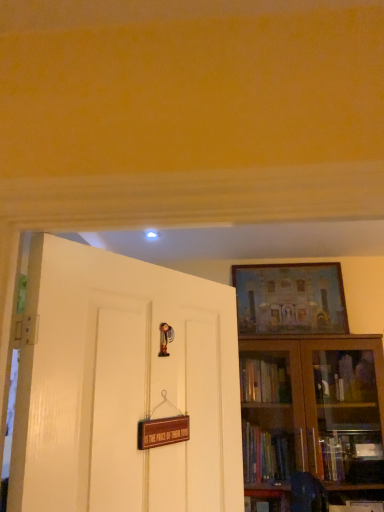
Question: From the image's perspective, does white glossy door at left appear higher than brown wooden bookcase at right?

Choices:
 (A) no
 (B) yes

Answer: (B)

Question: Is brown wooden bookcase at right inside white glossy door at left?

Choices:
 (A) no
 (B) yes

Answer: (A)

Question: Is white glossy door at left turned away from brown wooden bookcase at right?

Choices:
 (A) no
 (B) yes

Answer: (A)

Question: Considering the relative sizes of white glossy door at left and brown wooden bookcase at right in the image provided, is white glossy door at left thinner than brown wooden bookcase at right?

Choices:
 (A) no
 (B) yes

Answer: (B)

Question: Does white glossy door at left turn towards brown wooden bookcase at right?

Choices:
 (A) yes
 (B) no

Answer: (B)

Question: Considering their positions, is white glossy door at left located in front of or behind brown wooden bookcase at right?

Choices:
 (A) front
 (B) behind

Answer: (A)

Question: Which is correct: white glossy door at left is inside brown wooden bookcase at right, or outside of it?

Choices:
 (A) outside
 (B) inside

Answer: (A)

Question: From a real-world perspective, is white glossy door at left positioned above or below brown wooden bookcase at right?

Choices:
 (A) above
 (B) below

Answer: (A)

Question: Considering the relative positions of white glossy door at left and brown wooden bookcase at right in the image provided, is white glossy door at left to the left or to the right of brown wooden bookcase at right?

Choices:
 (A) right
 (B) left

Answer: (B)

Question: Considering the positions of white glossy door at left and matte wooden picture frame at upper right in the image, is white glossy door at left wider or thinner than matte wooden picture frame at upper right?

Choices:
 (A) wide
 (B) thin

Answer: (A)

Question: Considering the relative positions of white glossy door at left and matte wooden picture frame at upper right in the image provided, is white glossy door at left to the left or to the right of matte wooden picture frame at upper right?

Choices:
 (A) right
 (B) left

Answer: (B)

Question: Would you say white glossy door at left is inside or outside matte wooden picture frame at upper right?

Choices:
 (A) inside
 (B) outside

Answer: (B)

Question: Considering the positions of white glossy door at left and matte wooden picture frame at upper right in the image, is white glossy door at left taller or shorter than matte wooden picture frame at upper right?

Choices:
 (A) short
 (B) tall

Answer: (B)

Question: From a real-world perspective, is brown wooden bookcase at right physically located above or below matte wooden picture frame at upper right?

Choices:
 (A) below
 (B) above

Answer: (A)

Question: Considering the positions of brown wooden bookcase at right and matte wooden picture frame at upper right in the image, is brown wooden bookcase at right taller or shorter than matte wooden picture frame at upper right?

Choices:
 (A) short
 (B) tall

Answer: (B)